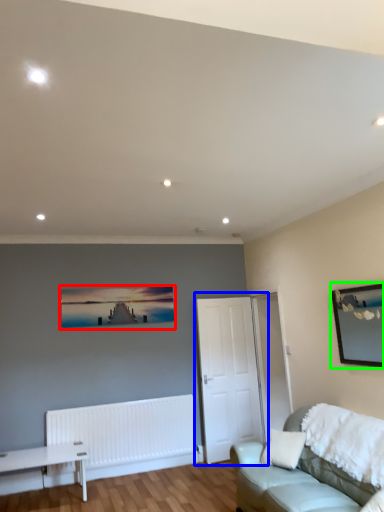
Question: Estimate the real-world distances between objects in this image. Which object is farther from picture frame (highlighted by a red box), door (highlighted by a blue box) or picture frame (highlighted by a green box)?

Choices:
 (A) door
 (B) picture frame

Answer: (B)